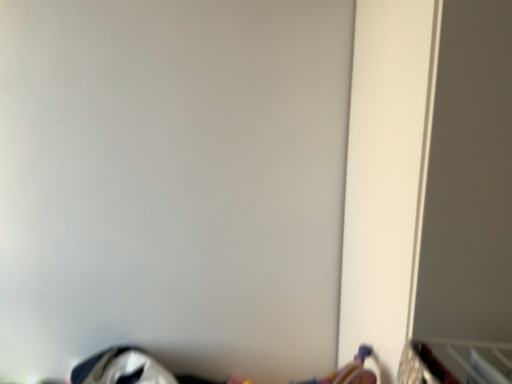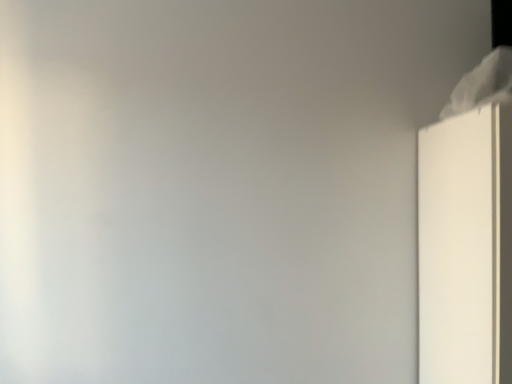
Question: Which way did the camera rotate in the video?

Choices:
 (A) rotated downward
 (B) rotated upward

Answer: (B)